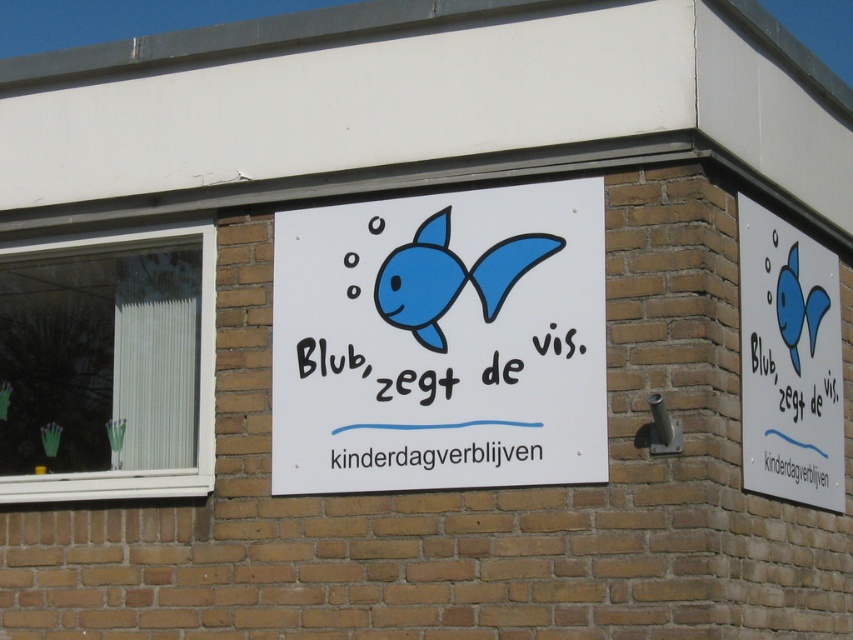
Does matte blue fish at center come in front of white paper at center?

No, matte blue fish at center is behind white paper at center.

Is matte blue fish at center below white paper at center?

Actually, matte blue fish at center is above white paper at center.

The width and height of the screenshot is (853, 640). What do you see at coordinates (450, 276) in the screenshot?
I see `matte blue fish at center` at bounding box center [450, 276].

The width and height of the screenshot is (853, 640). Identify the location of matte blue fish at center. (450, 276).

Does black painted text at center appear on the left side of white paper at center?

Incorrect, black painted text at center is not on the left side of white paper at center.

Between black painted text at center and white paper at center, which one appears on the left side from the viewer's perspective?

white paper at center

You are a GUI agent. You are given a task and a screenshot of the screen. Output one action in this format:
    pyautogui.click(x=<x>, y=<y>)
    Task: Click on the black painted text at center
    Image resolution: width=853 pixels, height=640 pixels.
    Given the screenshot: What is the action you would take?
    pyautogui.click(x=416, y=385)

Is point (817, 467) in front of point (323, 353)?

No, (817, 467) is behind (323, 353).

I want to click on blue matte fish at upper right, so click(788, 362).